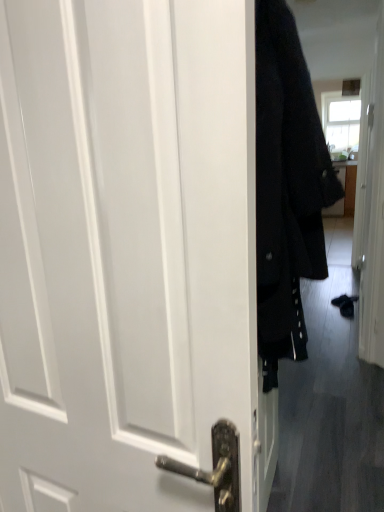
Question: Visually, is white matte door at center positioned to the left or to the right of velvet black coat at right?

Choices:
 (A) right
 (B) left

Answer: (B)

Question: Looking at their shapes, would you say white matte door at center is wider or thinner than velvet black coat at right?

Choices:
 (A) wide
 (B) thin

Answer: (B)

Question: From their relative heights in the image, would you say white matte door at center is taller or shorter than velvet black coat at right?

Choices:
 (A) short
 (B) tall

Answer: (A)

Question: Considering the positions of point (279, 78) and point (240, 350), is point (279, 78) closer or farther from the camera than point (240, 350)?

Choices:
 (A) farther
 (B) closer

Answer: (A)

Question: From their relative heights in the image, would you say velvet black coat at right is taller or shorter than white matte door at center?

Choices:
 (A) short
 (B) tall

Answer: (B)

Question: From a real-world perspective, is velvet black coat at right positioned above or below white matte door at center?

Choices:
 (A) below
 (B) above

Answer: (B)

Question: Would you say velvet black coat at right is to the left or to the right of white matte door at center in the picture?

Choices:
 (A) right
 (B) left

Answer: (A)